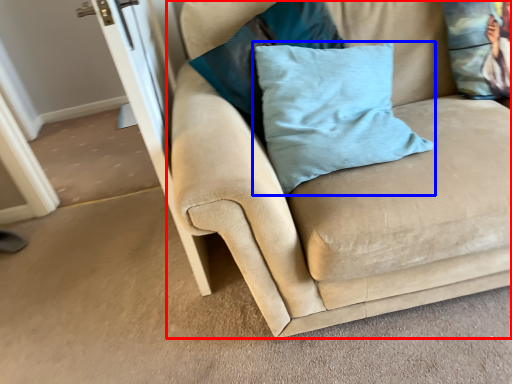
Question: Which object is further to the camera taking this photo, studio couch (highlighted by a red box) or pillow (highlighted by a blue box)?

Choices:
 (A) studio couch
 (B) pillow

Answer: (B)